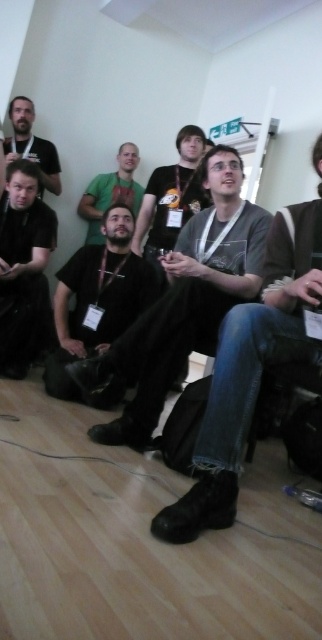
Question: Which point is farther from the camera taking this photo?

Choices:
 (A) (180, 225)
 (B) (15, 237)
 (C) (37, 156)

Answer: (C)

Question: Is matte black jacket at center above matte black shirt at left?

Choices:
 (A) no
 (B) yes

Answer: (A)

Question: Based on their relative distances, which object is farther from the matte black shirt at center?

Choices:
 (A) green fabric shirt at center
 (B) matte black jacket at center
 (C) denim jeans at center
 (D) matte black shirt at upper left

Answer: (C)

Question: Does matte black shirt at center have a lesser width compared to matte black shirt at left?

Choices:
 (A) no
 (B) yes

Answer: (A)

Question: Can you confirm if denim jeans at center is bigger than matte black shirt at center?

Choices:
 (A) no
 (B) yes

Answer: (A)

Question: Estimate the real-world distances between objects in this image. Which object is closer to the dark brown leather jacket at center?

Choices:
 (A) matte black shirt at left
 (B) denim jeans at center

Answer: (A)